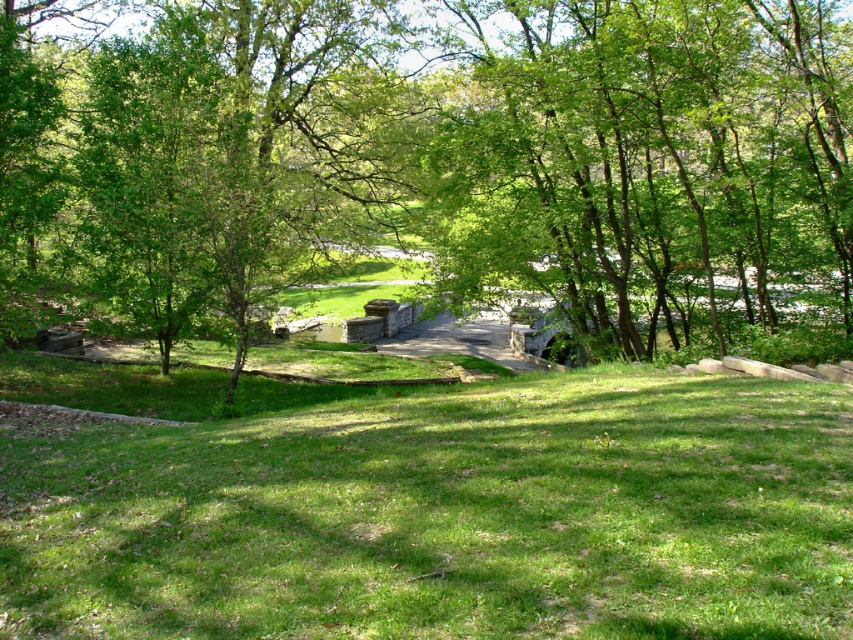
Who is shorter, green leafy tree at center or green grassy at center?

green grassy at center

Can you confirm if green leafy tree at center is positioned below green grassy at center?

Actually, green leafy tree at center is above green grassy at center.

Is point (248, 51) positioned after point (692, 589)?

Yes, point (248, 51) is farther from viewer.

At what (x,y) coordinates should I click in order to perform the action: click on green leafy tree at center. Please return your answer as a coordinate pair (x, y). This screenshot has height=640, width=853. Looking at the image, I should click on (444, 163).